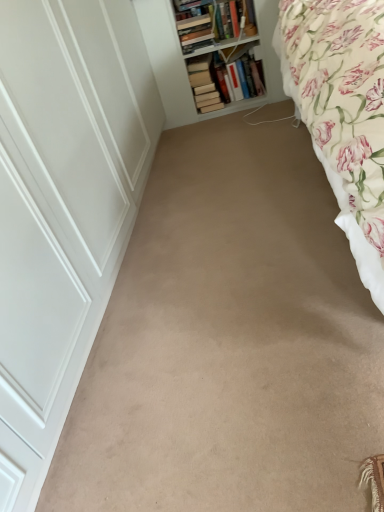
Question: Can you confirm if hardcover book at upper center, placed as the first book when sorted from left to right, is wider than floral cotton bed at right?

Choices:
 (A) no
 (B) yes

Answer: (A)

Question: Is hardcover book at upper center, placed as the first book when sorted from left to right, not inside floral cotton bed at right?

Choices:
 (A) no
 (B) yes

Answer: (B)

Question: Is hardcover book at upper center, placed as the first book when sorted from left to right, facing towards floral cotton bed at right?

Choices:
 (A) no
 (B) yes

Answer: (A)

Question: Considering the relative sizes of hardcover book at upper center, the third book in the right-to-left sequence, and floral cotton bed at right in the image provided, is hardcover book at upper center, the third book in the right-to-left sequence, thinner than floral cotton bed at right?

Choices:
 (A) no
 (B) yes

Answer: (B)

Question: Does hardcover book at upper center, placed as the first book when sorted from left to right, appear on the left side of floral cotton bed at right?

Choices:
 (A) yes
 (B) no

Answer: (A)

Question: Is hardcover book at upper center, the third book in the right-to-left sequence, not close to floral cotton bed at right?

Choices:
 (A) yes
 (B) no

Answer: (A)

Question: Would you say hardcover books at upper center, which is the 2th book from right to left, is a long distance from hardcover book at upper center, which appears as the first book when viewed from the right?

Choices:
 (A) no
 (B) yes

Answer: (A)

Question: Does hardcover books at upper center, which is the second book from left to right, lie behind hardcover book at upper center, the 3th book in the left-to-right sequence?

Choices:
 (A) no
 (B) yes

Answer: (A)

Question: Considering the relative positions of hardcover books at upper center, which is the second book from left to right, and hardcover book at upper center, the 3th book in the left-to-right sequence, in the image provided, is hardcover books at upper center, which is the second book from left to right, in front of hardcover book at upper center, the 3th book in the left-to-right sequence,?

Choices:
 (A) yes
 (B) no

Answer: (A)

Question: From the image's perspective, is hardcover books at upper center, which is the second book from left to right, over hardcover book at upper center, the 3th book in the left-to-right sequence?

Choices:
 (A) no
 (B) yes

Answer: (A)

Question: Can you confirm if hardcover books at upper center, which is the 2th book from right to left, is bigger than hardcover book at upper center, the 3th book in the left-to-right sequence?

Choices:
 (A) no
 (B) yes

Answer: (A)

Question: From a real-world perspective, is hardcover books at upper center, which is the 2th book from right to left, positioned over hardcover book at upper center, which appears as the first book when viewed from the right, based on gravity?

Choices:
 (A) yes
 (B) no

Answer: (A)

Question: Does hardcover book at upper center, placed as the first book when sorted from left to right, have a lesser height compared to beige carpet at center?

Choices:
 (A) yes
 (B) no

Answer: (B)